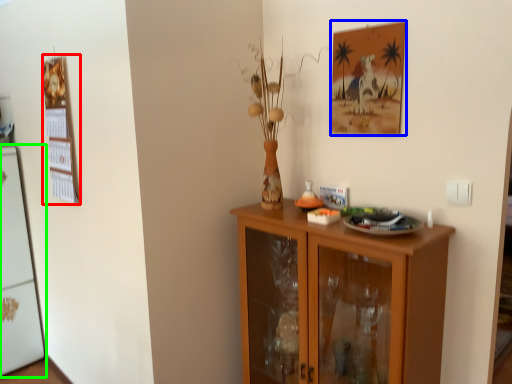
Question: Based on their relative distances, which object is nearer to bulletin board (highlighted by a red box)? Choose from picture frame (highlighted by a blue box) and fridge (highlighted by a green box).

Choices:
 (A) picture frame
 (B) fridge

Answer: (B)